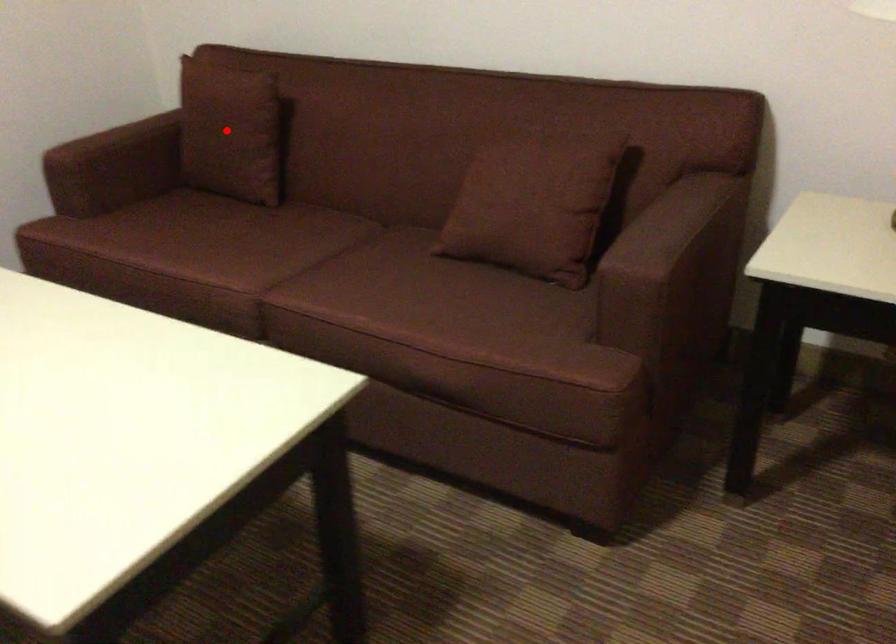
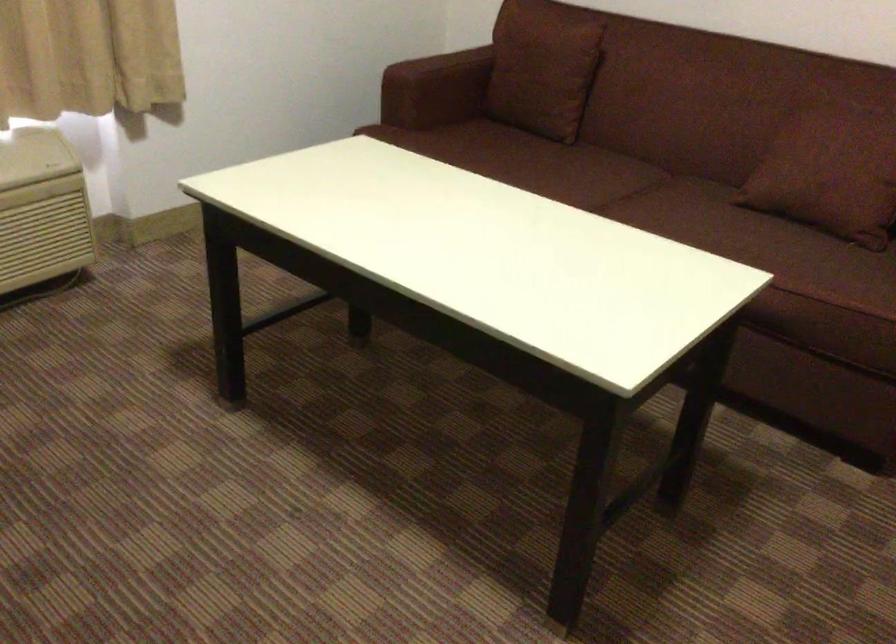
Question: I am providing you with two images of the same scene from different viewpoints. Image1 has a red point marked. In image2, the corresponding 3D location appears at what relative position? Reply with the corresponding letter.

Choices:
 (A) Closer
 (B) Farther

Answer: (B)